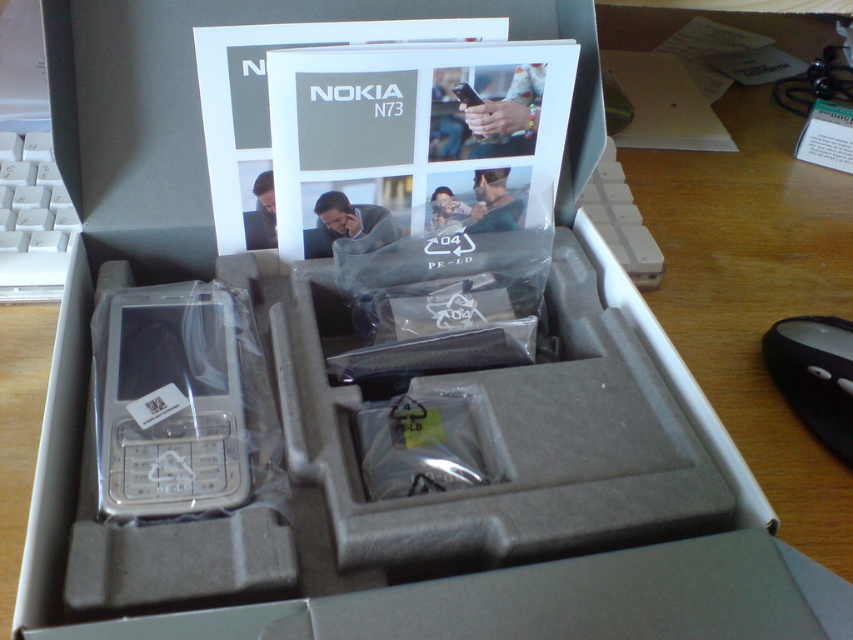
Between point (209, 436) and point (4, 278), which one is positioned in front?

Positioned in front is point (209, 436).

Does point (136, 380) come closer to viewer compared to point (13, 248)?

Yes, it is in front of point (13, 248).

Is point (123, 364) in front of point (4, 132)?

Yes, point (123, 364) is closer to viewer.

I want to click on silver metallic phone at center, so click(x=167, y=401).

Who is more distant from viewer, (x=227, y=304) or (x=839, y=388)?

Point (x=839, y=388)

The height and width of the screenshot is (640, 853). Identify the location of silver metallic phone at center. (167, 401).

Between point (131, 444) and point (809, 365), which one is positioned behind?

Point (809, 365)

Where is `silver metallic phone at center`? The width and height of the screenshot is (853, 640). silver metallic phone at center is located at coordinates (167, 401).

Describe the element at coordinates (32, 220) in the screenshot. The height and width of the screenshot is (640, 853). I see `white plastic keyboard at upper left` at that location.

Which is behind, point (13, 225) or point (827, 428)?

Point (13, 225)

At what (x,y) coordinates should I click in order to perform the action: click on white plastic keyboard at upper left. Please return your answer as a coordinate pair (x, y). The width and height of the screenshot is (853, 640). Looking at the image, I should click on (32, 220).